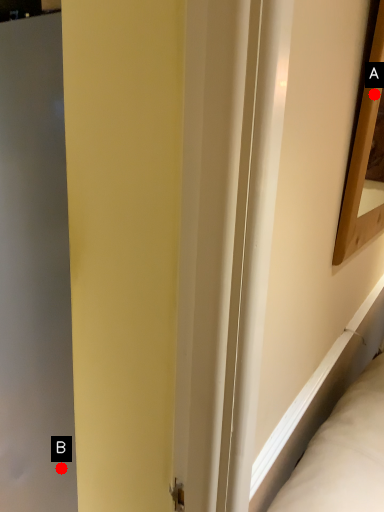
Question: Two points are circled on the image, labeled by A and B beside each circle. Which of the following is the farthest from the observer?

Choices:
 (A) A is further
 (B) B is further

Answer: (B)